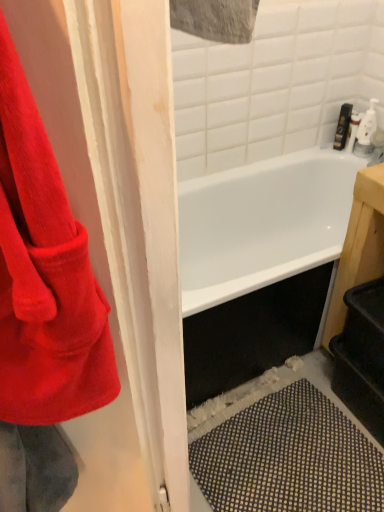
Question: From the image's perspective, relative to corduroy red towel at left, is matte black soap dispenser at upper right above or below?

Choices:
 (A) below
 (B) above

Answer: (B)

Question: Considering the positions of matte black soap dispenser at upper right and corduroy red towel at left in the image, is matte black soap dispenser at upper right taller or shorter than corduroy red towel at left?

Choices:
 (A) tall
 (B) short

Answer: (B)

Question: Relative to corduroy red towel at left, is matte black soap dispenser at upper right in front or behind?

Choices:
 (A) front
 (B) behind

Answer: (B)

Question: From the image's perspective, is corduroy red towel at left positioned above or below matte black soap dispenser at upper right?

Choices:
 (A) below
 (B) above

Answer: (A)

Question: Visually, is corduroy red towel at left positioned to the left or to the right of matte black soap dispenser at upper right?

Choices:
 (A) left
 (B) right

Answer: (A)

Question: From a real-world perspective, is corduroy red towel at left positioned above or below matte black soap dispenser at upper right?

Choices:
 (A) above
 (B) below

Answer: (A)

Question: Looking at their shapes, would you say corduroy red towel at left is wider or thinner than matte black soap dispenser at upper right?

Choices:
 (A) thin
 (B) wide

Answer: (B)